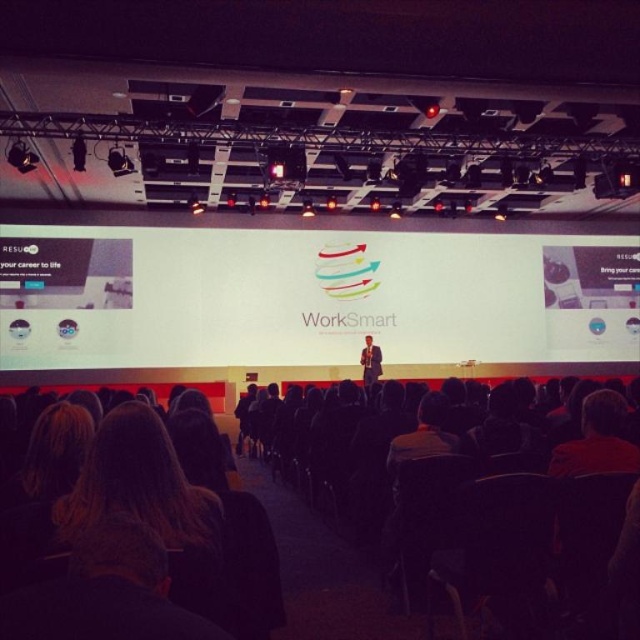
Is white matte projection screen at center below dark suit at center?

Incorrect, white matte projection screen at center is not positioned below dark suit at center.

Identify the location of white matte projection screen at center. (310, 296).